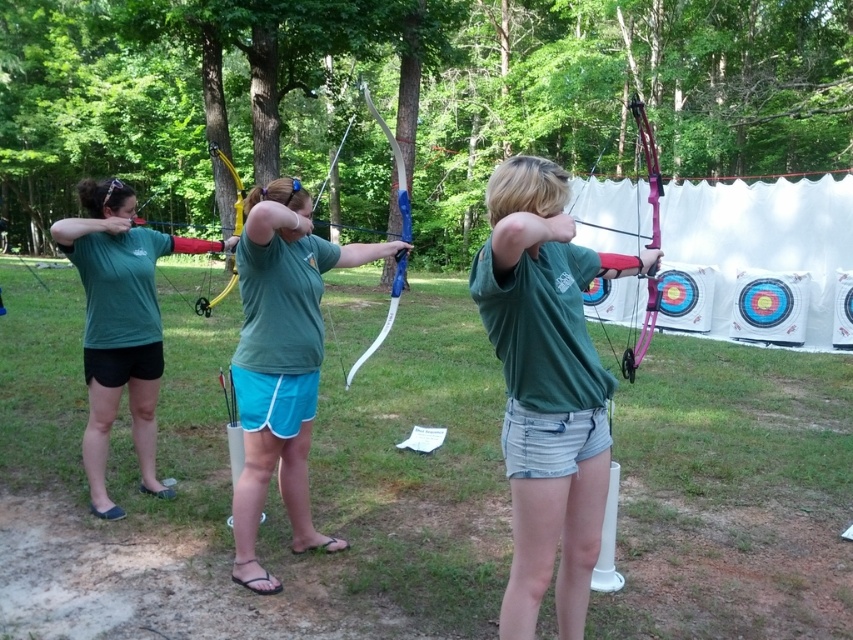
You are an archer standing behind the three participants. You need to retrieve the pink glossy bow at center first before the matte blue bow at center. Which one should you pick up first based on their positions?

The matte blue bow at center is closer to the viewer than the pink glossy bow at center, so you should pick up the matte blue bow at center first before reaching for the pink glossy bow at center.

You are an archer standing on the grassy area with patches of dirt. You want to aim your arrow towards the center of the targets. Based on the position of the matte blue bow at center, where should you aim relative to the bow?

The matte blue bow at center is located at point (281, 364). To aim towards the center of the targets, you should aim directly at the center point of the targets, which is likely aligned with the bow if it is positioned centrally. The bow is already at the center, so aim straight ahead from the bow.

You are an archer wearing a green matte shirt at center. You want to check if your shirt is wider than your pink glossy bow at center. Based on the scene, can you confirm?

The green matte shirt at center is less wide than the pink glossy bow at center, so no, the shirt is not wider than the bow.